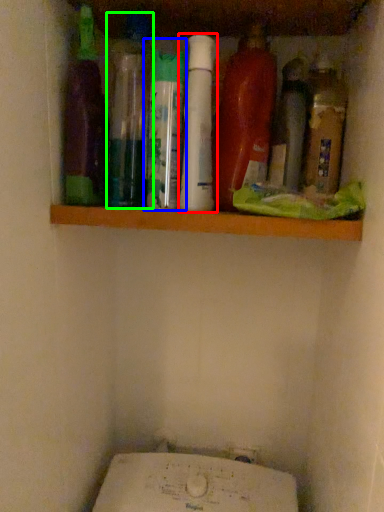
Question: Considering the real-world distances, which object is closest to bottle (highlighted by a red box)? bottle (highlighted by a blue box) or bottle (highlighted by a green box).

Choices:
 (A) bottle
 (B) bottle

Answer: (A)